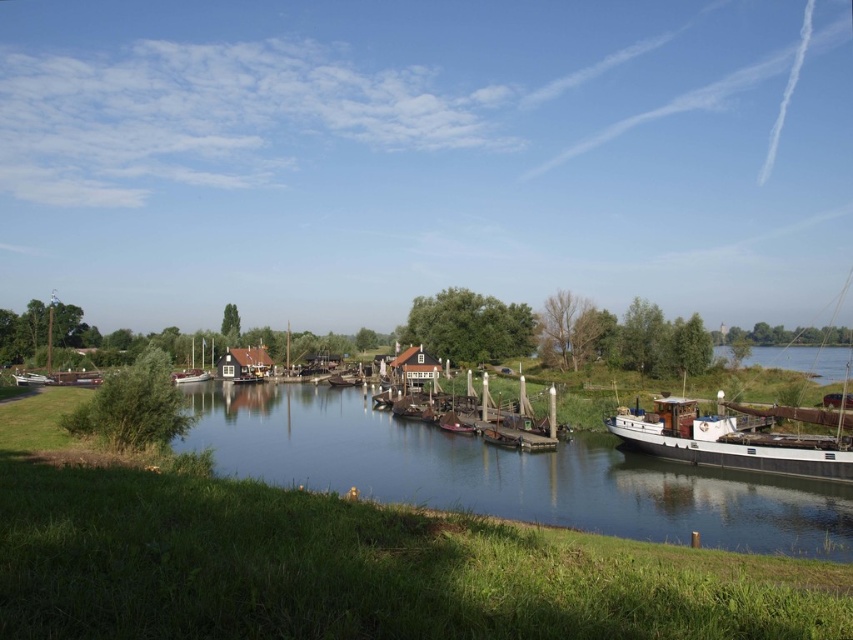
Between wooden sailboat at center and white wooden boat at center-left, which one has more height?

Standing taller between the two is wooden sailboat at center.

Is wooden sailboat at center bigger than white wooden boat at center-left?

Yes, wooden sailboat at center is bigger than white wooden boat at center-left.

You are a GUI agent. You are given a task and a screenshot of the screen. Output one action in this format:
    pyautogui.click(x=<x>, y=<y>)
    Task: Click on the wooden sailboat at center
    
    Given the screenshot: What is the action you would take?
    pyautogui.click(x=190, y=376)

The width and height of the screenshot is (853, 640). Describe the element at coordinates (474, 413) in the screenshot. I see `wooden boat at center` at that location.

Is wooden boat at center to the left of white wooden boat at center-left from the viewer's perspective?

In fact, wooden boat at center is to the right of white wooden boat at center-left.

Which is in front, point (457, 417) or point (183, 374)?

Point (457, 417) is in front.

I want to click on wooden boat at center, so click(x=474, y=413).

Can you confirm if white matte barge at right is positioned to the right of white wooden boat at center-left?

Indeed, white matte barge at right is positioned on the right side of white wooden boat at center-left.

Looking at this image, is white matte barge at right bigger than white wooden boat at center-left?

Incorrect, white matte barge at right is not larger than white wooden boat at center-left.

Find the location of `white matte barge at right`. white matte barge at right is located at coordinates (737, 436).